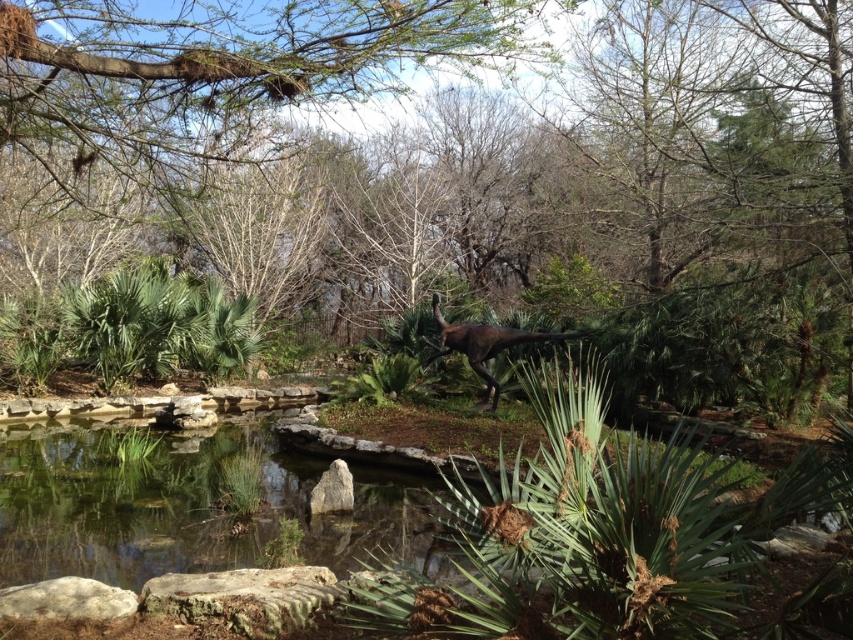
Between point (32, 584) and point (439, 349), which one is positioned behind?

Positioned behind is point (439, 349).

Does gray rough rock at lower left appear under shiny brown dinosaur at center?

Yes.

Where is `gray rough rock at lower left`? The height and width of the screenshot is (640, 853). gray rough rock at lower left is located at coordinates (67, 600).

The width and height of the screenshot is (853, 640). I want to click on gray rough rock at lower left, so click(67, 600).

Is clear water at pond center bigger than gray rough rock at center?

No.

What do you see at coordinates (186, 508) in the screenshot?
I see `clear water at pond center` at bounding box center [186, 508].

Between point (109, 580) and point (346, 467), which one is positioned in front?

Point (109, 580) is in front.

What are the coordinates of `clear water at pond center` in the screenshot? It's located at (186, 508).

Is green leafy tree at center smaller than gray rough rock at center?

Actually, green leafy tree at center might be larger than gray rough rock at center.

Does green leafy tree at center appear on the right side of gray rough rock at center?

Incorrect, green leafy tree at center is not on the right side of gray rough rock at center.

Find the location of a particular element. green leafy tree at center is located at coordinates (459, 172).